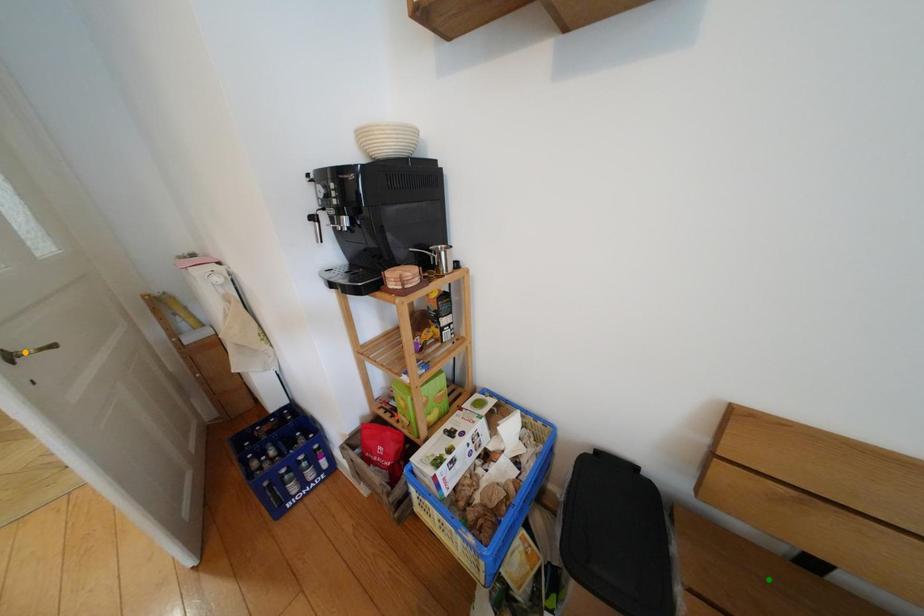
Order these from nearest to farthest:
A) orange point
B) green point
C) purple point

1. green point
2. purple point
3. orange point